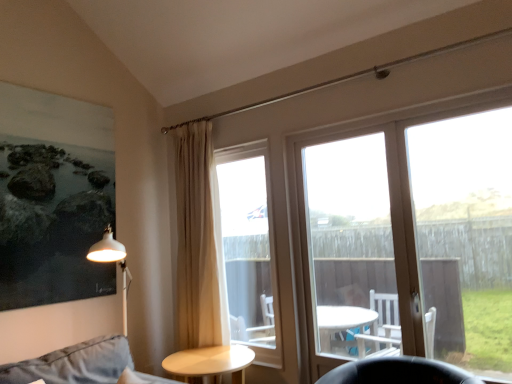
Question: From the image's perspective, is beige fabric curtain at center positioned above or below white glass door at center?

Choices:
 (A) above
 (B) below

Answer: (A)

Question: Based on their sizes in the image, would you say beige fabric curtain at center is bigger or smaller than white glass door at center?

Choices:
 (A) small
 (B) big

Answer: (B)

Question: Which object is positioned farthest from the white glass door at center?

Choices:
 (A) beige fabric curtain at center
 (B) transparent glass door at upper right
 (C) light beige wooden table at center
 (D) clear glass door at center right
 (E) clear glass door at center

Answer: (A)

Question: Considering the real-world distances, which object is farthest from the clear glass door at center?

Choices:
 (A) clear glass door at center right
 (B) transparent glass door at upper right
 (C) light beige wooden table at center
 (D) white glass door at center
 (E) beige fabric curtain at center

Answer: (A)